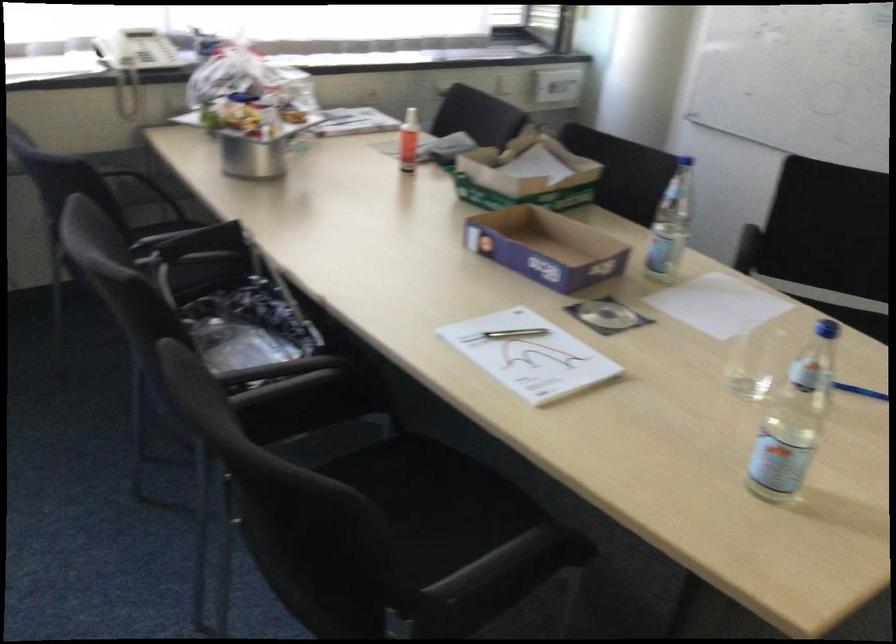
What are the coordinates of `clear drinking glass` in the screenshot? It's located at (754, 362).